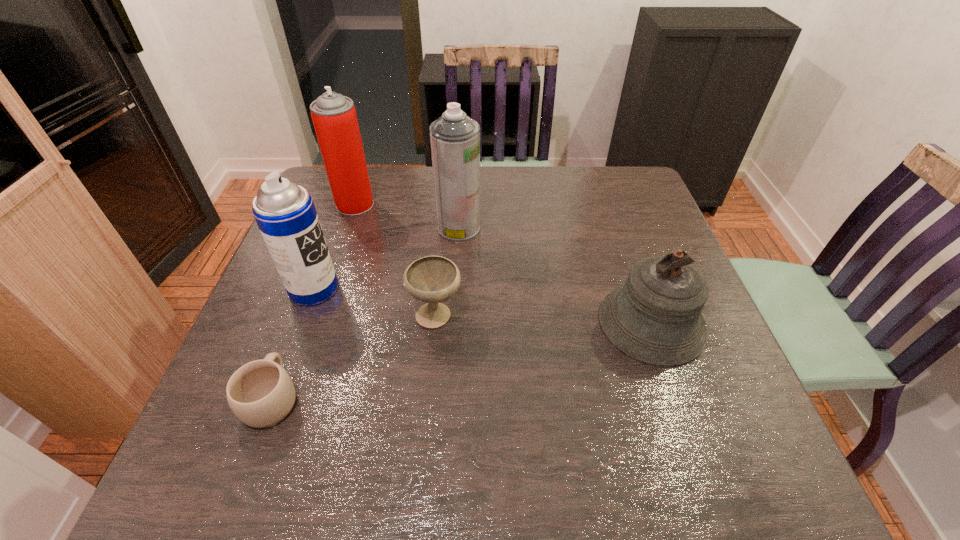
Find the location of a particular element. Image resolution: width=960 pixels, height=540 pixels. blank space located on the back of the second shortest object is located at coordinates (439, 279).

This screenshot has width=960, height=540. In order to click on free space located 0.310m on the side of the shortest object with the handle in this screenshot , I will do `click(322, 264)`.

Where is `free point located on the side of the shortest object with the handle`? The height and width of the screenshot is (540, 960). free point located on the side of the shortest object with the handle is located at coordinates pos(330,241).

The width and height of the screenshot is (960, 540). What are the coordinates of `blank space located 0.080m on the side of the shortest object with the handle` in the screenshot? It's located at (295, 336).

The height and width of the screenshot is (540, 960). Find the location of `object that is at the far edge`. object that is at the far edge is located at coordinates (334, 117).

Where is `mug that is at the left edge`? This screenshot has height=540, width=960. mug that is at the left edge is located at coordinates (261, 394).

Identify the location of object situated at the right edge. Image resolution: width=960 pixels, height=540 pixels. (655, 318).

You are a GUI agent. You are given a task and a screenshot of the screen. Output one action in this format:
    pyautogui.click(x=<x>, y=<y>)
    Task: Click on the object located at the far left corner
    The height and width of the screenshot is (540, 960).
    Given the screenshot: What is the action you would take?
    pyautogui.click(x=334, y=117)

Locate an element on the screen. This screenshot has height=540, width=960. free space at the far edge of the desktop is located at coordinates (391, 207).

The image size is (960, 540). In order to click on free spot at the near edge of the desktop in this screenshot , I will do `click(642, 444)`.